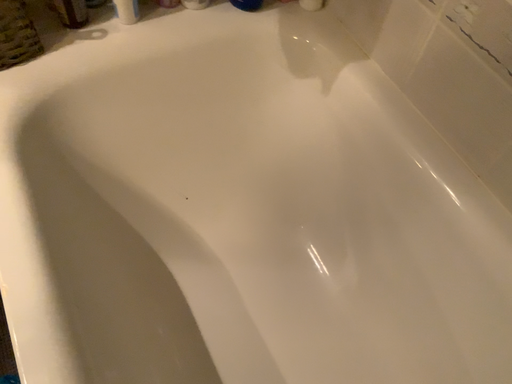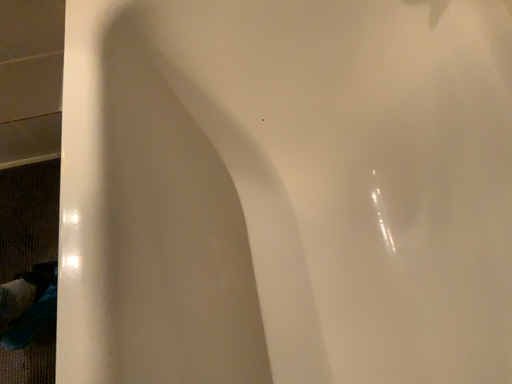
Question: Which way did the camera rotate in the video?

Choices:
 (A) rotated left
 (B) rotated right

Answer: (A)